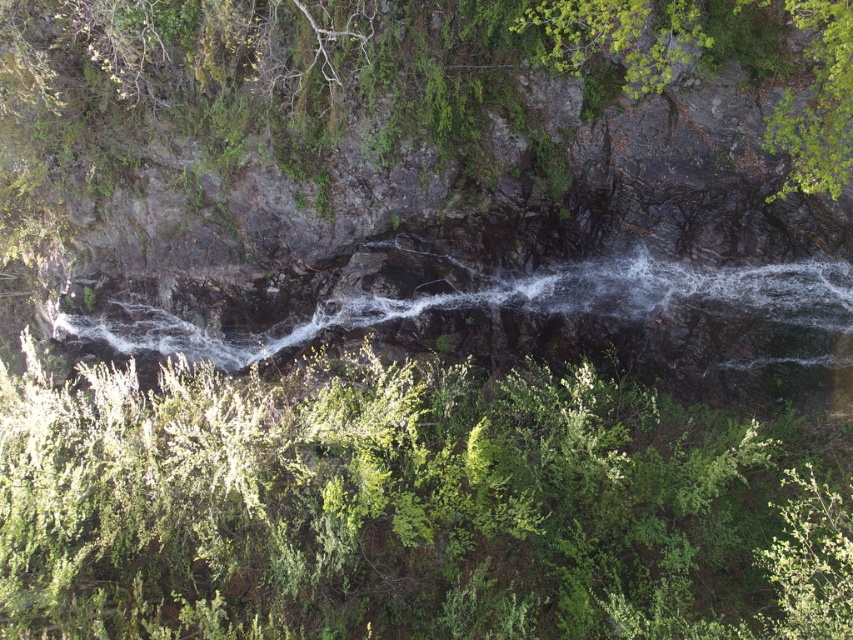
You are a hiker planning to take a photo of the green leafy shrub at upper center and the white frothy water at center. Which object should you focus on first if you want to capture both in a single frame without moving the camera?

You should focus on the green leafy shrub at upper center first because its width is larger than the white frothy water at center, allowing it to dominate the frame while still including the smaller white frothy water at center.

You are standing at the base of the waterfall in the image and want to reach a specific location marked by point (614, 538). However, there is another point at (753, 333) in your path. Based on their positions, which point should you avoid stepping on to stay closer to your destination?

You should avoid stepping on point (753, 333) because point (614, 538) is in front of it, meaning the destination is closer to you than the other point. Stepping on the farther point would take you away from your target.

In the scene shown: You are a hiker standing at the base of the waterfall. You see a green leafy shrub at upper center and a white frothy water at center. Which object is nearer to you?

The green leafy shrub at upper center is closer to the viewer than the white frothy water at center.